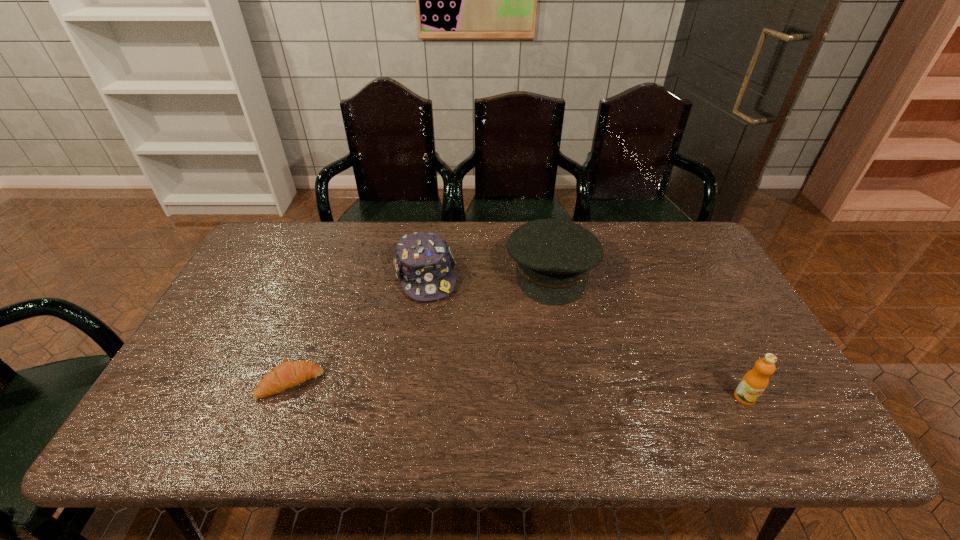
What are the coordinates of `vacant space that's between the orange juice and the leftmost object` in the screenshot? It's located at (517, 390).

At what (x,y) coordinates should I click in order to perform the action: click on unoccupied area between the orange juice and the shortest object. Please return your answer as a coordinate pair (x, y). The height and width of the screenshot is (540, 960). Looking at the image, I should click on (517, 390).

At what (x,y) coordinates should I click in order to perform the action: click on free space between the shortest object and the rightmost object. Please return your answer as a coordinate pair (x, y). The width and height of the screenshot is (960, 540). Looking at the image, I should click on (517, 390).

This screenshot has height=540, width=960. In order to click on free space between the beret and the orange juice in this screenshot , I will do `click(648, 334)`.

Find the location of a particular element. Image resolution: width=960 pixels, height=540 pixels. the closest object to the beret is located at coordinates (424, 264).

Select which object is the closest to the rightmost object. Please provide its 2D coordinates. Your answer should be formatted as a tuple, i.e. [(x, y)], where the tuple contains the x and y coordinates of a point satisfying the conditions above.

[(553, 257)]

Image resolution: width=960 pixels, height=540 pixels. In order to click on free spot that satisfies the following two spatial constraints: 1. on the back side of the shortest object; 2. on the left side of the beret in this screenshot , I will do `click(333, 271)`.